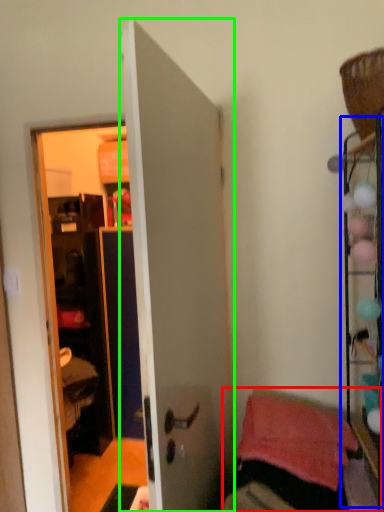
Question: Which object is the farthest from furniture (highlighted by a red box)? Choose among these: shelf (highlighted by a blue box) or door (highlighted by a green box).

Choices:
 (A) shelf
 (B) door

Answer: (B)